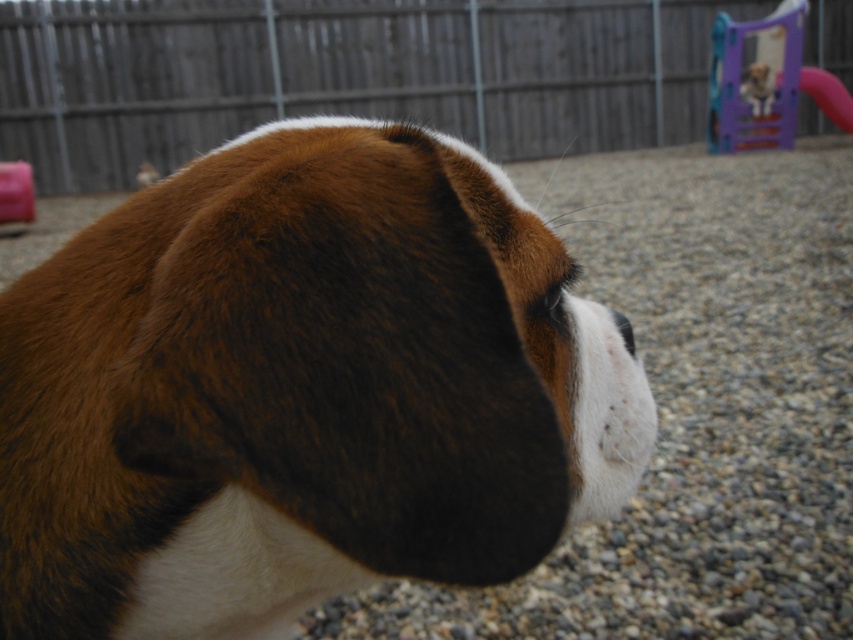
Question: Where is brown furry dog at center located in relation to gray gravel at center in the image?

Choices:
 (A) above
 (B) below

Answer: (B)

Question: Can you confirm if gray gravel at center is positioned below plastic purple slide at upper right?

Choices:
 (A) yes
 (B) no

Answer: (A)

Question: Which object is closer to the camera taking this photo?

Choices:
 (A) plastic purple slide at upper right
 (B) brown furry dog at center

Answer: (B)

Question: Which point is closer to the camera taking this photo?

Choices:
 (A) (97, 525)
 (B) (714, 52)
 (C) (732, 586)

Answer: (A)

Question: Which object appears farthest from the camera in this image?

Choices:
 (A) plastic purple slide at upper right
 (B) gray gravel at center
 (C) brown furry dog at center

Answer: (A)

Question: Is gray gravel at center closer to the viewer compared to plastic purple slide at upper right?

Choices:
 (A) no
 (B) yes

Answer: (B)